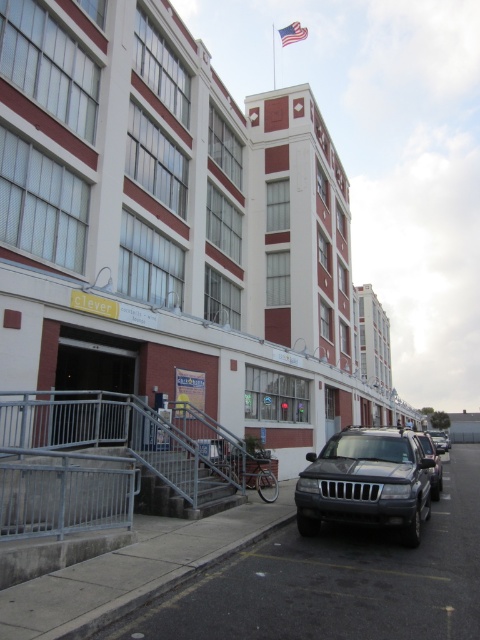
Question: Which of these objects is positioned farthest from the satin black suv at lower center?

Choices:
 (A) satin silver suv at center
 (B) matte white building at center
 (C) matte silver suv at center

Answer: (A)

Question: Which point appears farthest from the camera in this image?

Choices:
 (A) (441, 442)
 (B) (287, 29)
 (C) (319, 481)

Answer: (B)

Question: Is satin black suv at lower center below american flag at upper center?

Choices:
 (A) no
 (B) yes

Answer: (B)

Question: Does matte silver suv at center have a smaller size compared to satin silver suv at center?

Choices:
 (A) no
 (B) yes

Answer: (B)

Question: Which of the following is the farthest from the observer?

Choices:
 (A) coord(296,32)
 (B) coord(432,436)

Answer: (A)

Question: Can you confirm if matte silver suv at center is positioned to the left of american flag at upper center?

Choices:
 (A) no
 (B) yes

Answer: (B)